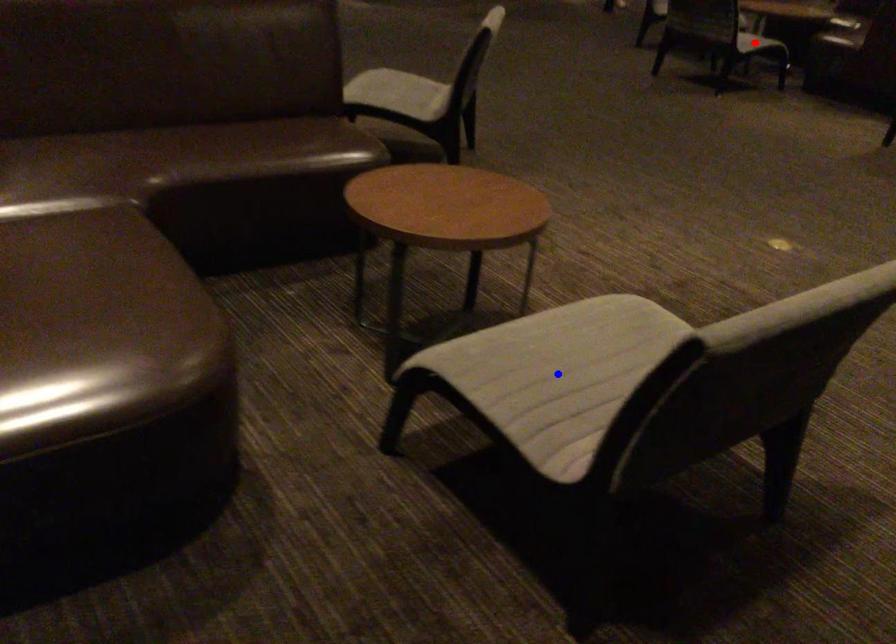
Question: Two points are marked on the image. Which point is closer to the camera?

Choices:
 (A) Blue point is closer.
 (B) Red point is closer.

Answer: (A)